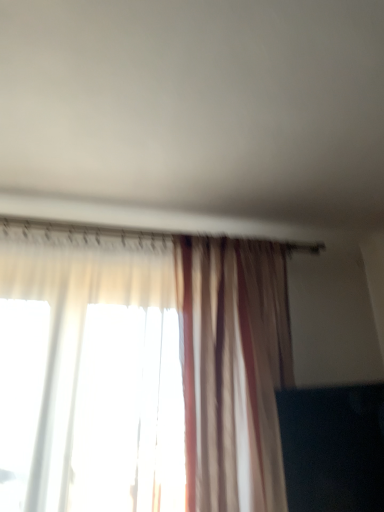
Question: Relative to black glossy tv at lower right, is translucent striped curtain at center in front or behind?

Choices:
 (A) front
 (B) behind

Answer: (A)

Question: Visually, is translucent striped curtain at center positioned to the left or to the right of black glossy tv at lower right?

Choices:
 (A) right
 (B) left

Answer: (B)

Question: Choose the correct answer: Is translucent striped curtain at center inside black glossy tv at lower right or outside it?

Choices:
 (A) inside
 (B) outside

Answer: (B)

Question: Do you think black glossy tv at lower right is within translucent striped curtain at center, or outside of it?

Choices:
 (A) inside
 (B) outside

Answer: (A)

Question: In terms of width, does black glossy tv at lower right look wider or thinner when compared to translucent striped curtain at center?

Choices:
 (A) wide
 (B) thin

Answer: (B)

Question: Relative to translucent striped curtain at center, is black glossy tv at lower right in front or behind?

Choices:
 (A) front
 (B) behind

Answer: (B)

Question: Considering the positions of point (291, 462) and point (256, 403), is point (291, 462) closer or farther from the camera than point (256, 403)?

Choices:
 (A) farther
 (B) closer

Answer: (B)